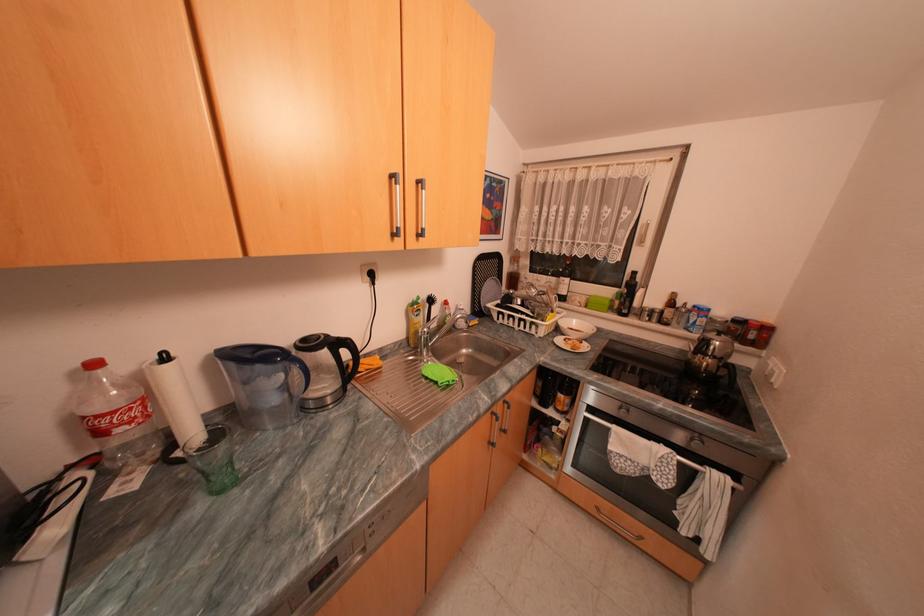
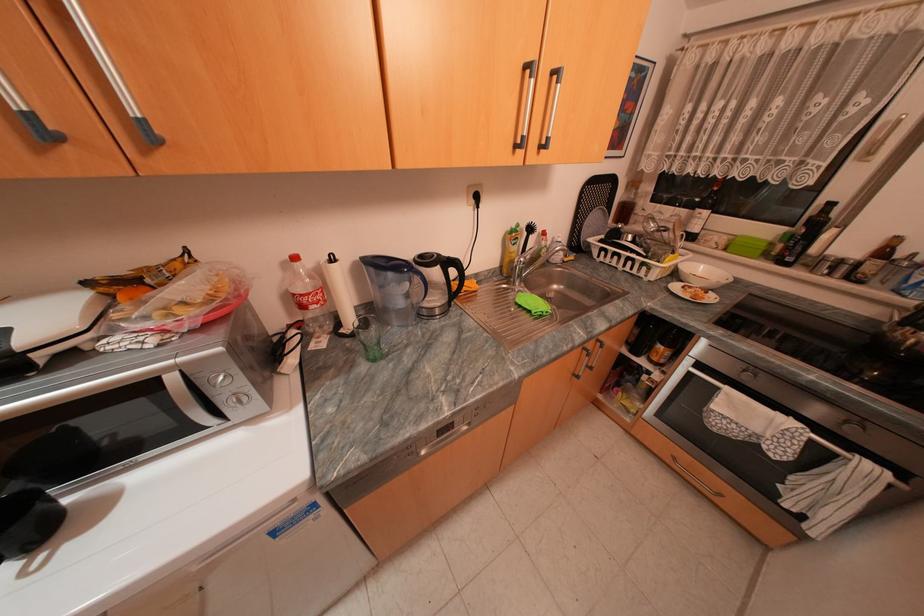
Where in the second image is the point corresponding to point 140,422 from the first image?

(326, 302)